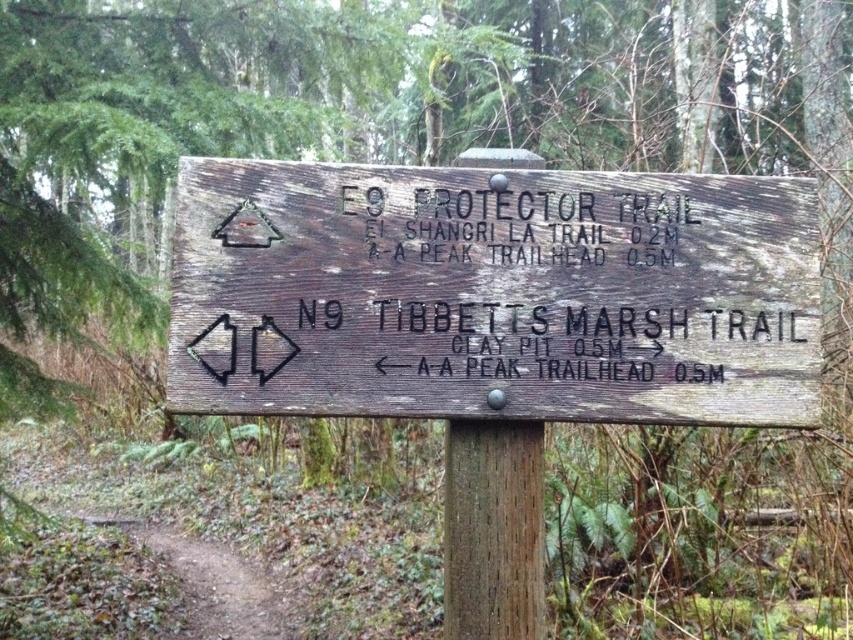
Based on the photo, who is higher up, weathered brown wood at center or brown dirt path at lower left?

weathered brown wood at center is above.

Describe the element at coordinates (492, 529) in the screenshot. The image size is (853, 640). I see `weathered brown wood at center` at that location.

Between point (448, 497) and point (254, 636), which one is positioned behind?

Point (254, 636)

This screenshot has height=640, width=853. In order to click on weathered brown wood at center in this screenshot , I will do `click(492, 529)`.

Does weathered wood sign at center have a lesser height compared to weathered brown wood at center?

Answer: No.

This screenshot has width=853, height=640. I want to click on weathered wood sign at center, so click(x=492, y=292).

Does point (801, 321) lie in front of point (93, 518)?

Yes, point (801, 321) is closer to viewer.

Can you confirm if weathered wood sign at center is positioned to the right of brown dirt path at lower left?

Indeed, weathered wood sign at center is positioned on the right side of brown dirt path at lower left.

You are a GUI agent. You are given a task and a screenshot of the screen. Output one action in this format:
    pyautogui.click(x=<x>, y=<y>)
    Task: Click on the weathered wood sign at center
    The image size is (853, 640).
    Given the screenshot: What is the action you would take?
    pyautogui.click(x=492, y=292)

The image size is (853, 640). In order to click on weathered wood sign at center in this screenshot , I will do `click(492, 292)`.